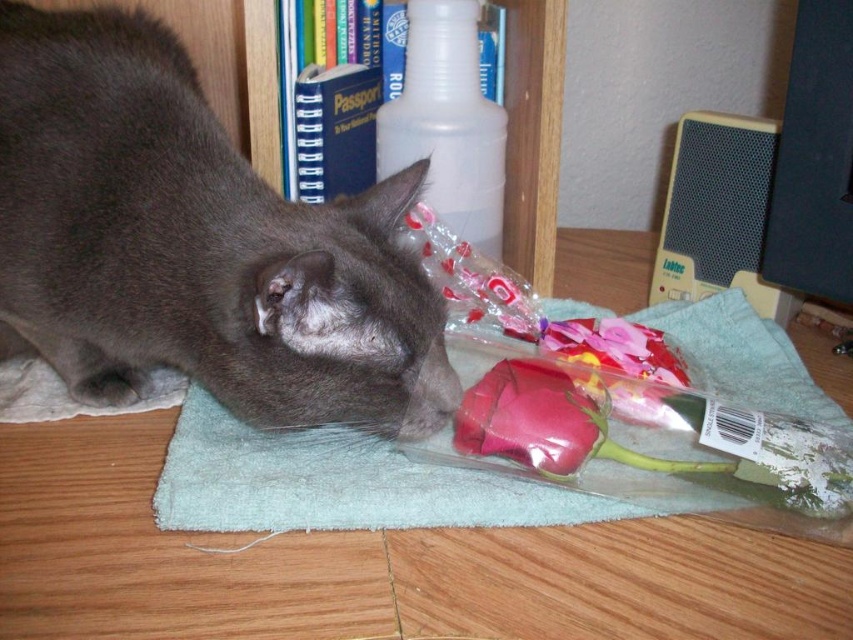
Who is more forward, (447, 504) or (506, 422)?

Point (447, 504) is in front.

Who is taller, teal towel at lower center or matte pink rose at lower center?

teal towel at lower center is taller.

Where is `teal towel at lower center`? Image resolution: width=853 pixels, height=640 pixels. teal towel at lower center is located at coordinates (335, 484).

Is wooden bookshelf at upper center smaller than translucent plastic rose at lower center?

No, wooden bookshelf at upper center is not smaller than translucent plastic rose at lower center.

Between wooden bookshelf at upper center and translucent plastic rose at lower center, which one has more height?

wooden bookshelf at upper center is taller.

Does point (524, 134) lie behind point (654, 339)?

That is True.

Find the location of `wooden bookshelf at upper center`. wooden bookshelf at upper center is located at coordinates (532, 134).

Between gray fur cat at center and translucent plastic rose at lower center, which one has more height?

gray fur cat at center is taller.

Is gray fur cat at center below translucent plastic rose at lower center?

Incorrect, gray fur cat at center is not positioned below translucent plastic rose at lower center.

Is point (128, 221) behind point (573, 353)?

No, it is not.

Where is `gray fur cat at center`? The height and width of the screenshot is (640, 853). gray fur cat at center is located at coordinates (196, 244).